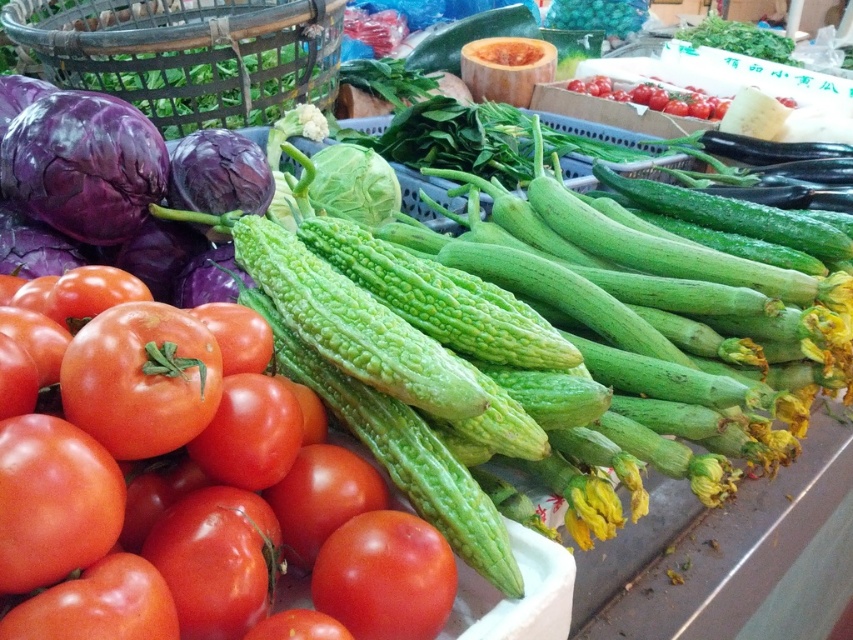
Question: Observing the image, what is the correct spatial positioning of shiny red tomato at lower left in reference to green matte cabbage at center?

Choices:
 (A) below
 (B) above

Answer: (A)

Question: Among these objects, which one is nearest to the camera?

Choices:
 (A) red matte tomato at center
 (B) shiny red tomato at lower left
 (C) ripe red tomato at lower left

Answer: (B)

Question: Is shiny red tomato at lower left thinner than red matte tomato at center?

Choices:
 (A) no
 (B) yes

Answer: (A)

Question: Which object is the closest to the rustic bamboo basket at upper left?

Choices:
 (A) red matte tomato at center
 (B) shiny red tomato at lower left

Answer: (B)

Question: Which of these objects is positioned closest to the shiny red tomato at lower left?

Choices:
 (A) green matte cabbage at center
 (B) red matte tomato at lower left
 (C) ripe red tomato at lower left

Answer: (C)

Question: Can you confirm if shiny red tomato at lower left is smaller than red matte tomato at center?

Choices:
 (A) yes
 (B) no

Answer: (B)